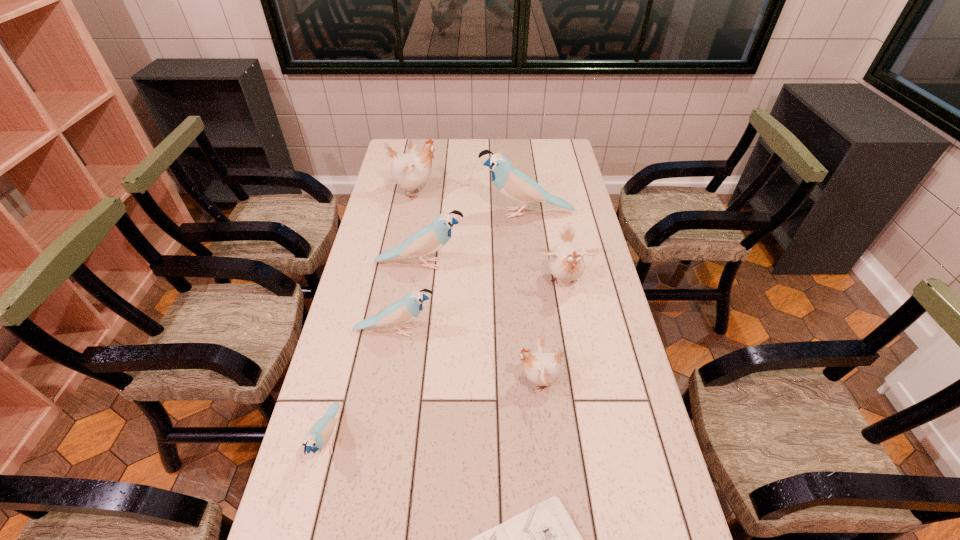
Locate an element on the screen. The height and width of the screenshot is (540, 960). free region located at the face of the farthest blue bird is located at coordinates (449, 213).

Find the location of `free location located at the face of the farthest blue bird`. free location located at the face of the farthest blue bird is located at coordinates (x=436, y=213).

Find the location of a particular element. The image size is (960, 540). vacant point located at the face of the farthest blue bird is located at coordinates (449, 213).

Identify the location of vacant space located 0.360m at the beak of the biggest white bird. (530, 192).

Where is `vacant space located at the face of the second biggest blue bird`? vacant space located at the face of the second biggest blue bird is located at coordinates point(534,264).

Locate an element on the screen. The height and width of the screenshot is (540, 960). free space located 0.110m at the beak of the second nearest white bird is located at coordinates (573, 329).

Locate an element on the screen. The width and height of the screenshot is (960, 540). free space located 0.230m at the face of the fourth nearest object is located at coordinates coord(516,331).

Locate an element on the screen. The image size is (960, 540). free space located at the beak of the nearest white bird is located at coordinates click(400, 381).

The image size is (960, 540). Find the location of `free region located 0.110m at the beak of the nearest white bird`. free region located 0.110m at the beak of the nearest white bird is located at coordinates (473, 381).

Where is `vacant point located 0.120m at the beak of the nearest white bird`? vacant point located 0.120m at the beak of the nearest white bird is located at coordinates (469, 381).